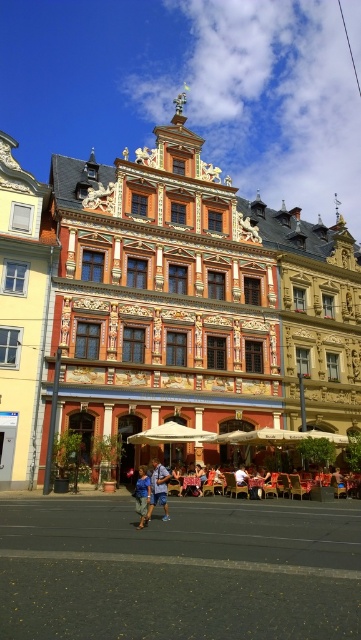
Looking at this image, is blue denim shorts at center thinner than blue denim shorts at lower center?

Yes, blue denim shorts at center is thinner than blue denim shorts at lower center.

Is blue denim shorts at center positioned behind blue denim shorts at lower center?

Yes, blue denim shorts at center is behind blue denim shorts at lower center.

Find the location of `blue denim shorts at center`. blue denim shorts at center is located at coordinates (158, 490).

Between point (92, 161) and point (142, 508), which one is positioned behind?

The point (92, 161) is more distant.

The image size is (361, 640). What are the coordinates of `wooden carved building at center` in the screenshot? It's located at (168, 310).

Is wooden carved building at center bigger than blue denim shorts at center?

Indeed, wooden carved building at center has a larger size compared to blue denim shorts at center.

Does wooden carved building at center lie behind blue denim shorts at center?

Yes, it is.

Which is in front, point (305, 248) or point (151, 461)?

Point (151, 461)

I want to click on wooden carved building at center, so click(x=168, y=310).